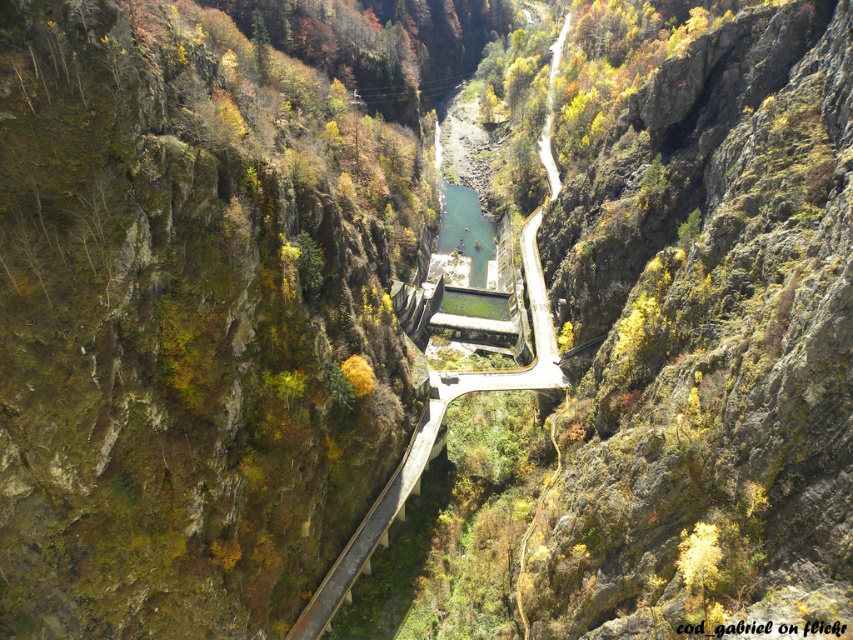
Can you confirm if concrete at center is shorter than dark gray concrete bridge at center?

Incorrect, concrete at center's height does not fall short of dark gray concrete bridge at center's.

Based on the photo, is concrete at center to the right of dark gray concrete bridge at center from the viewer's perspective?

Incorrect, concrete at center is not on the right side of dark gray concrete bridge at center.

Who is more forward, (457, 376) or (466, 301)?

Point (457, 376) is more forward.

Locate an element on the screen. The width and height of the screenshot is (853, 640). concrete at center is located at coordinates (434, 436).

Between point (366, 536) and point (491, 237), which one is positioned behind?

Positioned behind is point (491, 237).

Find the location of a particular element. The width and height of the screenshot is (853, 640). concrete at center is located at coordinates [x=434, y=436].

Describe the element at coordinates (434, 436) in the screenshot. The width and height of the screenshot is (853, 640). I see `concrete at center` at that location.

The height and width of the screenshot is (640, 853). I want to click on concrete at center, so click(434, 436).

Is dark gray concrete bridge at center closer to the viewer compared to green stone river at center?

Yes, dark gray concrete bridge at center is closer to the viewer.

Who is more distant from viewer, (x=488, y=296) or (x=461, y=209)?

Point (x=461, y=209)

Where is `dark gray concrete bridge at center`? This screenshot has height=640, width=853. dark gray concrete bridge at center is located at coordinates (474, 316).

You are a GUI agent. You are given a task and a screenshot of the screen. Output one action in this format:
    pyautogui.click(x=<x>, y=<y>)
    Task: Click on the dark gray concrete bridge at center
    
    Given the screenshot: What is the action you would take?
    pyautogui.click(x=474, y=316)